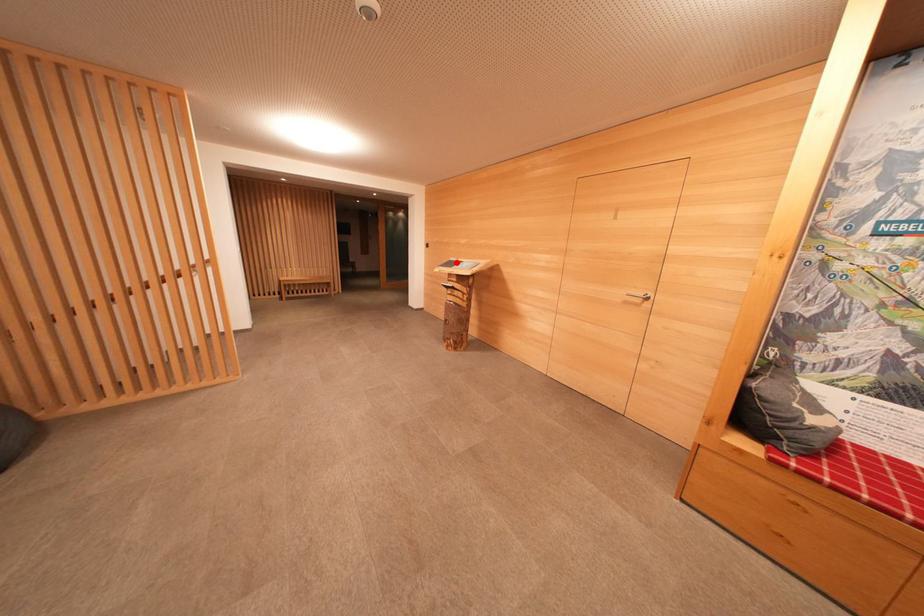
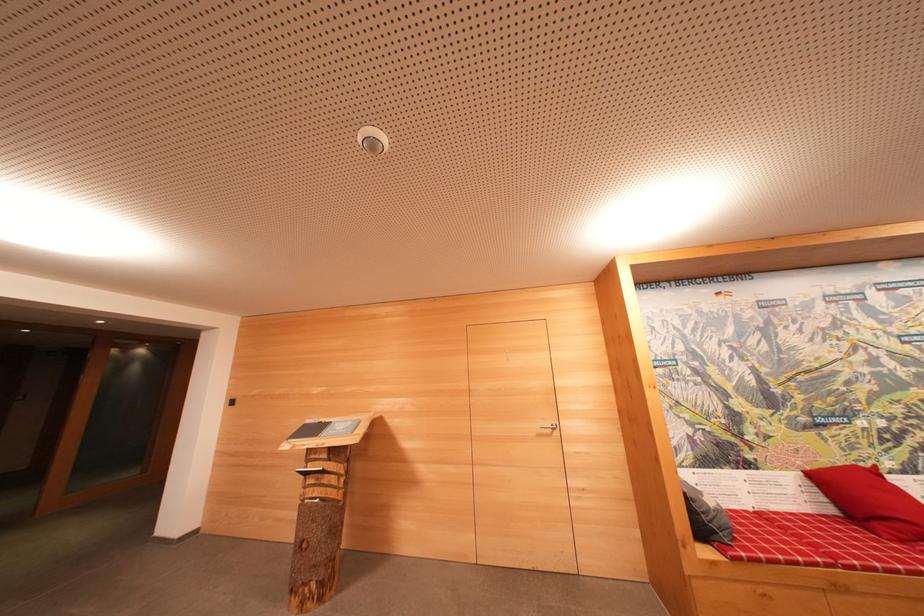
Question: I am providing you with two images of the same scene from different viewpoints. In image1, a red point is highlighted. Considering the same 3D point in image2, which of the following is correct?

Choices:
 (A) It is closer
 (B) It is farther

Answer: (B)